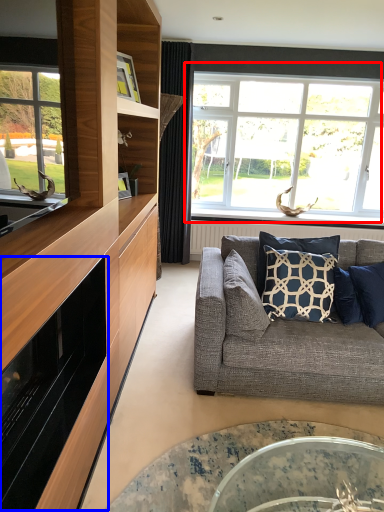
Question: Which of the following is the farthest to the observer, window (highlighted by a red box) or appliance (highlighted by a blue box)?

Choices:
 (A) window
 (B) appliance

Answer: (A)